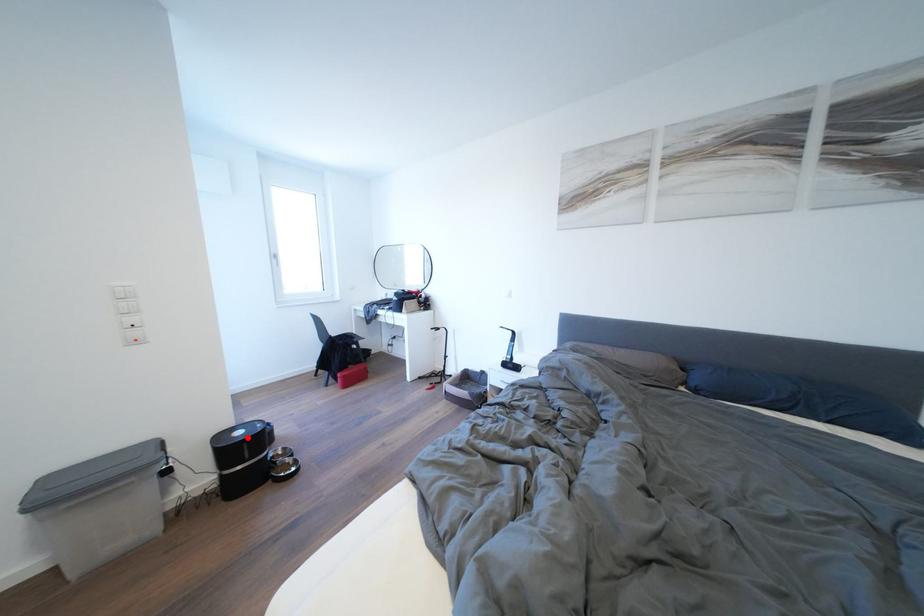
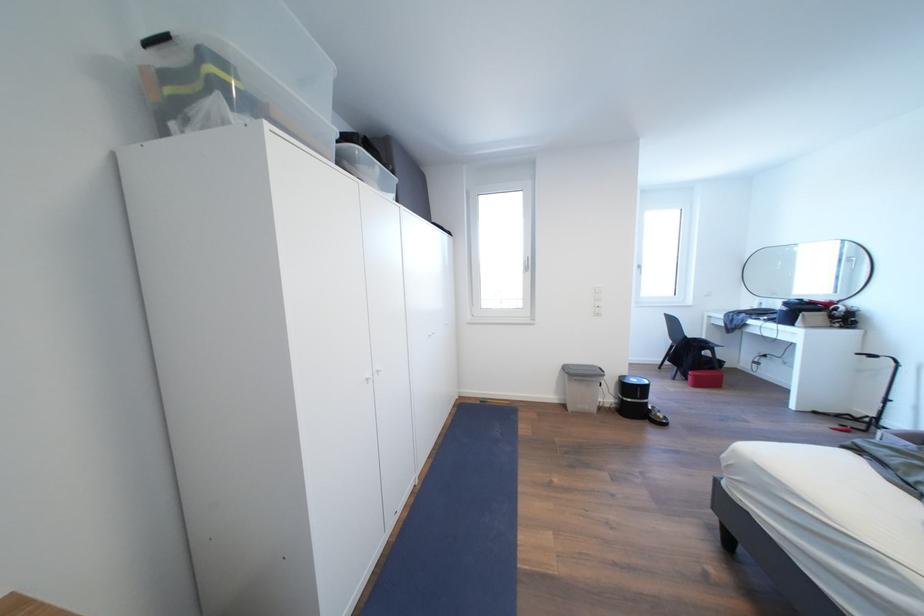
Where in the second image is the point corresponding to the highlighted location from the first image?

(641, 386)